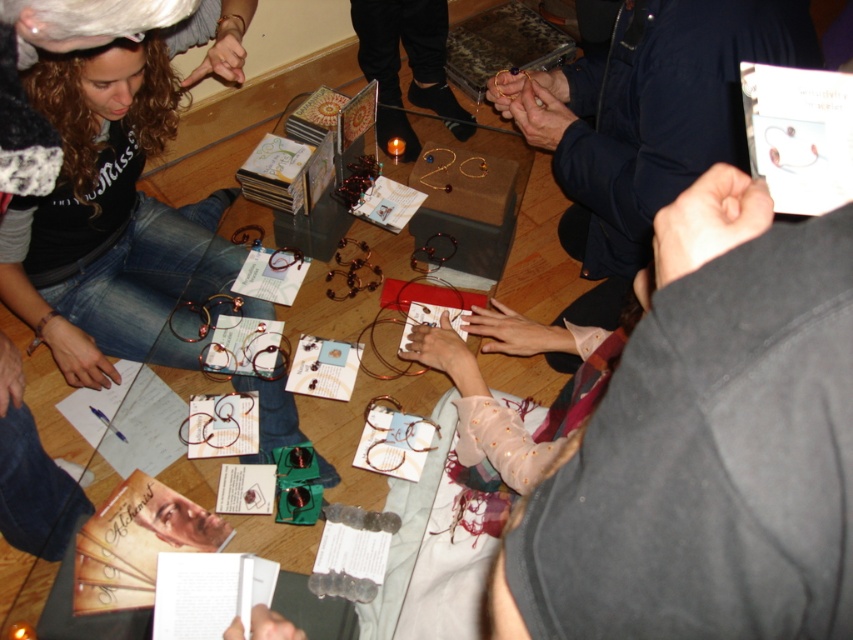
Is matte black jacket at upper right bigger than transparent glass table at center?

No.

Which is below, matte black jacket at upper right or transparent glass table at center?

transparent glass table at center

Measure the distance between point (596,307) and camera.

Point (596,307) is 1.68 meters from camera.

Locate an element on the screen. matte black jacket at upper right is located at coordinates (645, 122).

How far apart are matte black hairband at lower left and matte black bracelet at center?

matte black hairband at lower left is 33.56 inches from matte black bracelet at center.

Can you confirm if matte black hairband at lower left is positioned to the right of matte black bracelet at center?

In fact, matte black hairband at lower left is to the left of matte black bracelet at center.

Is point (202, 225) positioned after point (439, 104)?

No, it is in front of (439, 104).

Where is `matte black hairband at lower left`? The image size is (853, 640). matte black hairband at lower left is located at coordinates (119, 205).

Is matte black jacket at upper right positioned behind matte black bracelet at center?

That is False.

Does matte black jacket at upper right have a lesser height compared to matte black bracelet at center?

Incorrect, matte black jacket at upper right's height does not fall short of matte black bracelet at center's.

Does point (527, 108) lie behind point (397, 113)?

No, (527, 108) is in front of (397, 113).

At what (x,y) coordinates should I click in order to perform the action: click on matte black jacket at upper right. Please return your answer as a coordinate pair (x, y). Looking at the image, I should click on tap(645, 122).